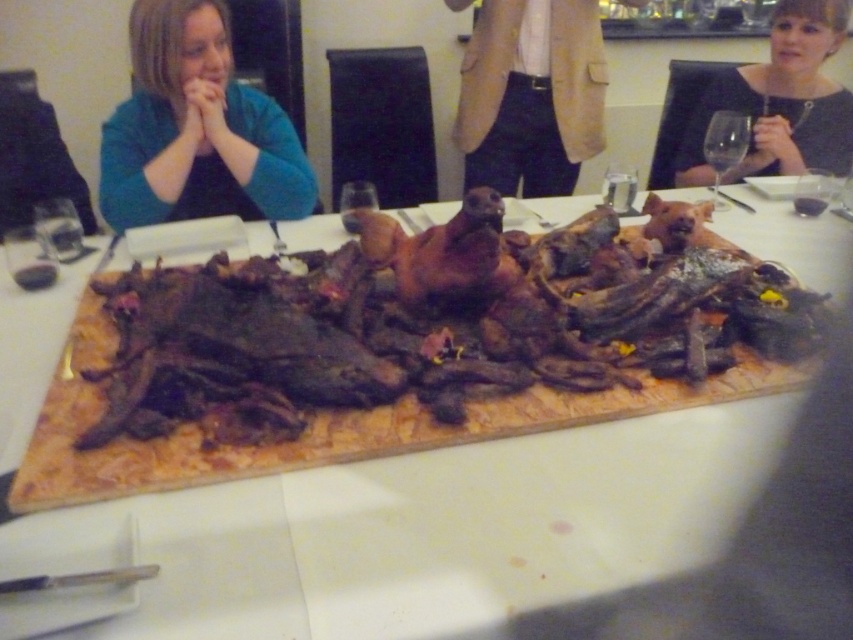
Question: Which of the following is the farthest from the observer?

Choices:
 (A) (798, 93)
 (B) (582, 72)
 (C) (518, 563)

Answer: (B)

Question: Which point is farther to the camera?

Choices:
 (A) dark gray dress at upper right
 (B) teal fabric at left
 (C) brown wooden board at center
 (D) transparent glass at upper right

Answer: (A)

Question: Considering the relative positions of tan fabric coat at upper center and dark gray dress at upper right in the image provided, where is tan fabric coat at upper center located with respect to dark gray dress at upper right?

Choices:
 (A) above
 (B) below

Answer: (A)

Question: Can you confirm if tan fabric coat at upper center is thinner than dark gray dress at upper right?

Choices:
 (A) yes
 (B) no

Answer: (B)

Question: Is teal fabric at left below brown wooden board at center?

Choices:
 (A) no
 (B) yes

Answer: (A)

Question: Among these objects, which one is nearest to the camera?

Choices:
 (A) tan fabric coat at upper center
 (B) brown wooden board at center
 (C) teal fabric at left
 (D) dark gray dress at upper right

Answer: (B)